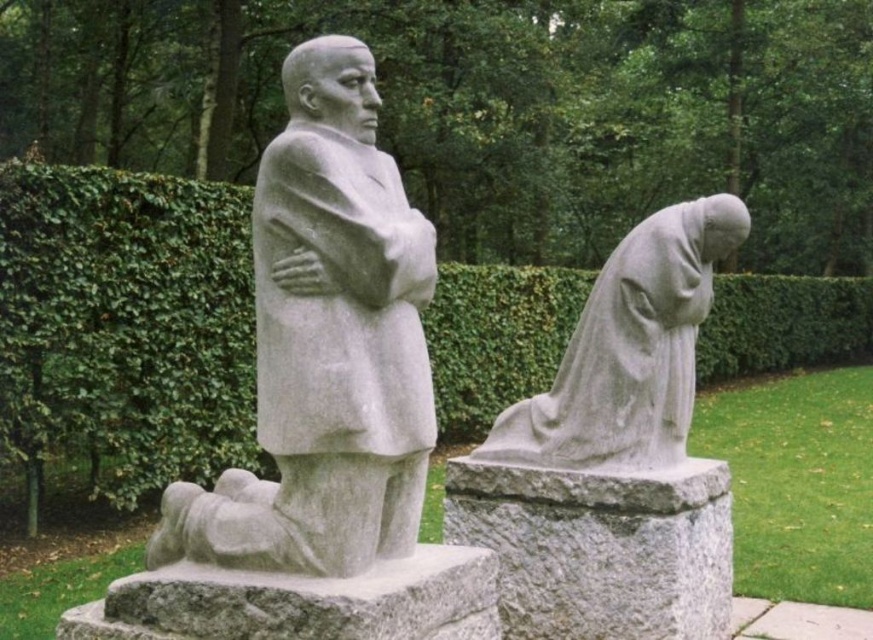
Between white stone statue at center and gray stone statue at lower right, which one is positioned lower?

gray stone statue at lower right

Is white stone statue at center above gray stone statue at lower right?

Yes, white stone statue at center is above gray stone statue at lower right.

Does point (314, 481) lie behind point (633, 324)?

No, it is not.

Find the location of a particular element. The width and height of the screenshot is (873, 640). white stone statue at center is located at coordinates (325, 346).